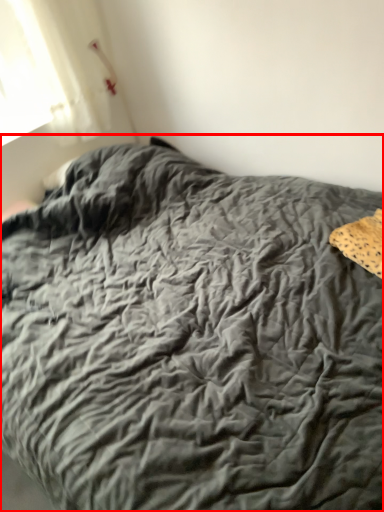
Question: From the image's perspective, what is the correct spatial positioning of bed (annotated by the red box) in reference to material?

Choices:
 (A) above
 (B) below

Answer: (B)